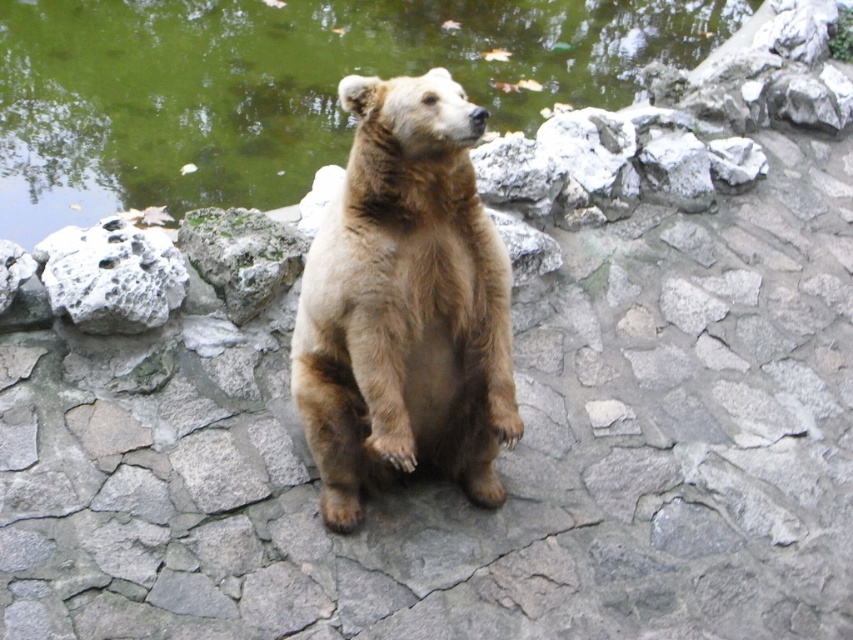
Is green water at upper center smaller than white porous rock at left?

Incorrect, green water at upper center is not smaller in size than white porous rock at left.

The height and width of the screenshot is (640, 853). Find the location of `green water at upper center`. green water at upper center is located at coordinates (281, 86).

Can you confirm if brown furry bear at center is positioned below white porous rock at left?

Indeed, brown furry bear at center is positioned under white porous rock at left.

In the scene shown: Is brown furry bear at center to the left of white porous rock at left from the viewer's perspective?

No, brown furry bear at center is not to the left of white porous rock at left.

Between point (439, 316) and point (51, 280), which one is positioned in front?

Positioned in front is point (439, 316).

In order to click on brown furry bear at center in this screenshot , I will do `click(405, 304)`.

Who is shorter, green water at upper center or brown furry bear at center?

With less height is brown furry bear at center.

Which is more to the left, green water at upper center or brown furry bear at center?

green water at upper center

What are the coordinates of `green water at upper center` in the screenshot? It's located at (281, 86).